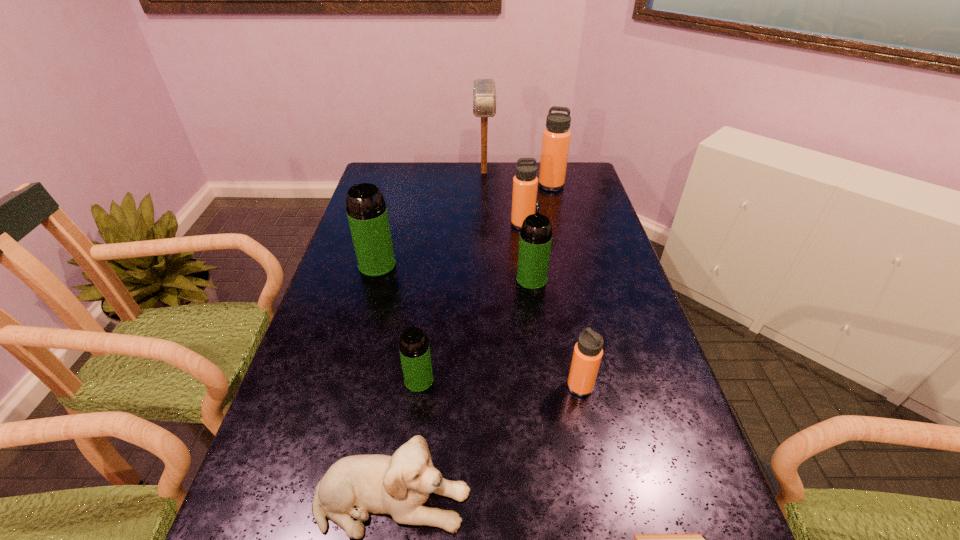
Find the location of a particular element. mallet that is positioned at the far edge is located at coordinates [484, 90].

Where is `thermos bottle present at the far edge`? This screenshot has height=540, width=960. thermos bottle present at the far edge is located at coordinates (556, 136).

The image size is (960, 540). I want to click on object at the left edge, so click(366, 209).

This screenshot has height=540, width=960. Find the location of `object present at the right edge`. object present at the right edge is located at coordinates (556, 136).

Locate an element on the screen. object located at the far right corner is located at coordinates (556, 136).

Locate an element on the screen. This screenshot has height=540, width=960. free point at the far edge is located at coordinates (440, 191).

Identify the location of vacant space at the left edge. The height and width of the screenshot is (540, 960). (387, 199).

In the image, there is a desktop. At what (x,y) coordinates should I click in order to perform the action: click on vacant space at the right edge. Please return your answer as a coordinate pair (x, y). The image size is (960, 540). Looking at the image, I should click on (577, 211).

In the image, there is a desktop. Where is `blank space at the far right corner`? The height and width of the screenshot is (540, 960). blank space at the far right corner is located at coordinates (589, 183).

The width and height of the screenshot is (960, 540). Identify the location of free space between the second biggest green thermos bottle and the leftmost green thermos bottle. (454, 272).